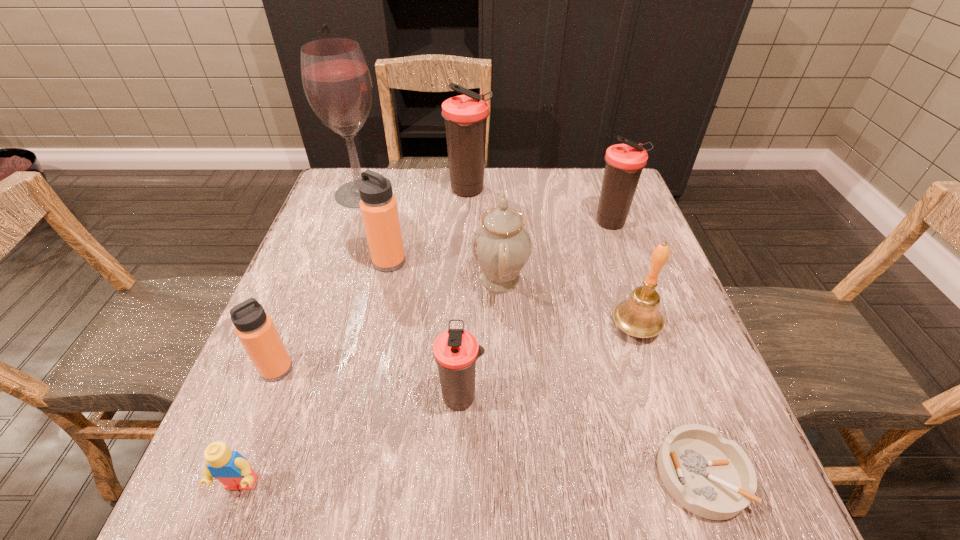
Where is `free region located 0.370m on the spout of the chinaware`? free region located 0.370m on the spout of the chinaware is located at coordinates (310, 280).

Find the location of a particular element. vacant region located on the spout of the chinaware is located at coordinates (332, 280).

The image size is (960, 540). What are the coordinates of `vacant space located 0.250m on the spout of the chinaware` in the screenshot? It's located at (362, 280).

Image resolution: width=960 pixels, height=540 pixels. I want to click on free space located on the back of the bell, so click(x=611, y=251).

Where is `blank space located 0.150m on the front of the smallest brown thermos bottle`? The height and width of the screenshot is (540, 960). blank space located 0.150m on the front of the smallest brown thermos bottle is located at coordinates (457, 509).

The image size is (960, 540). Identify the location of free region located on the right of the leftmost thermos bottle. (409, 369).

Find the location of a particular element. free spot located on the left of the ashtray is located at coordinates (556, 475).

This screenshot has height=540, width=960. What are the coordinates of `alcohol present at the far edge` in the screenshot? It's located at (336, 80).

Identify the location of Lego that is at the near edge. (234, 471).

The image size is (960, 540). I want to click on ashtray present at the near edge, so click(710, 476).